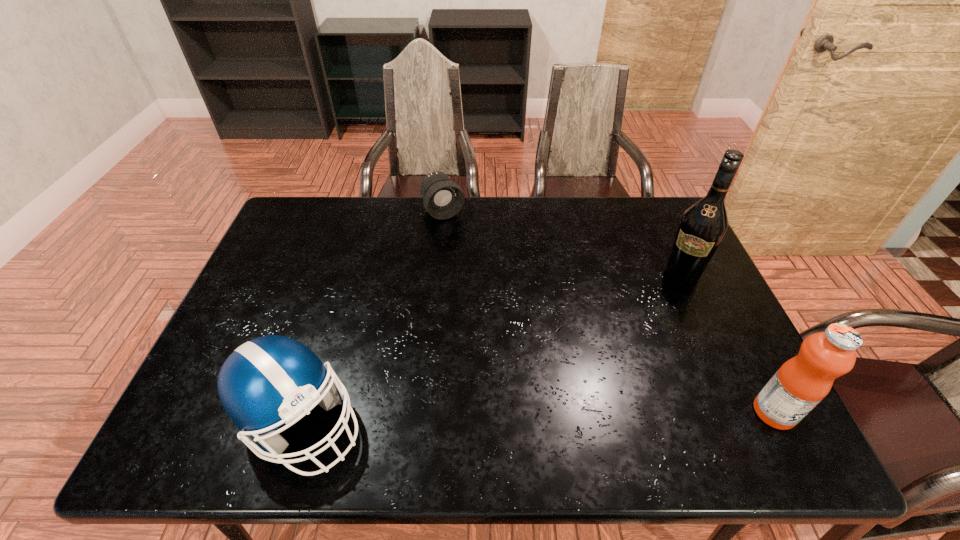
The image size is (960, 540). In order to click on vacant space that satisfies the following two spatial constraints: 1. on the front side of the third object from right to left; 2. on the front label of the fruit juice in this screenshot , I will do click(423, 412).